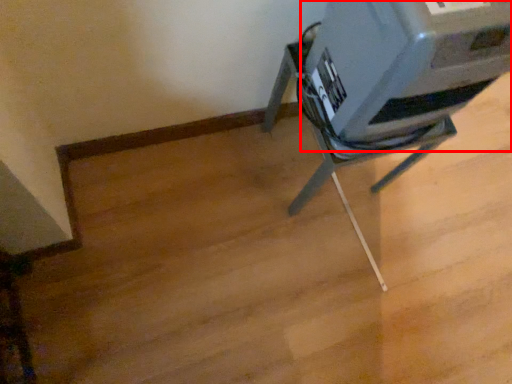
Question: Considering the relative positions of printer (annotated by the red box) and furniture in the image provided, where is printer (annotated by the red box) located with respect to the staircase?

Choices:
 (A) right
 (B) left

Answer: (A)